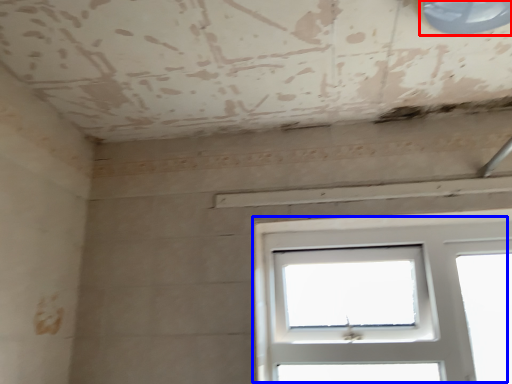
Question: Which object is further to the camera taking this photo, window (highlighted by a red box) or window (highlighted by a blue box)?

Choices:
 (A) window
 (B) window

Answer: (B)